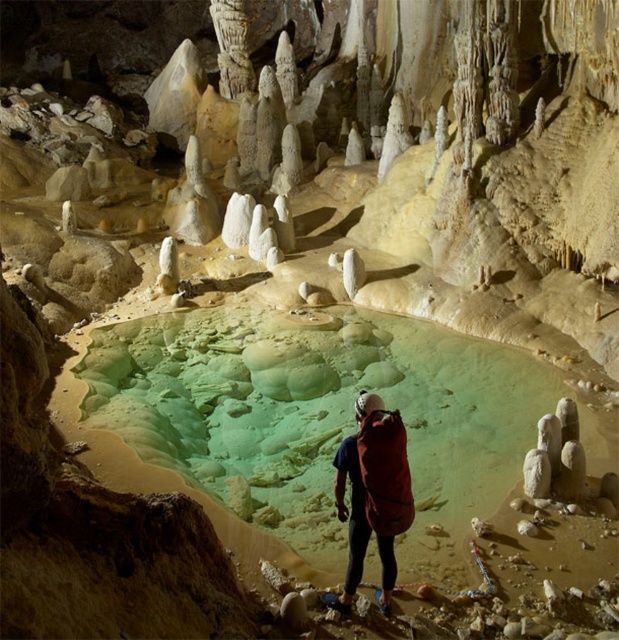
Which is more to the right, green translucent water at center or matte orange backpack at center?

green translucent water at center is more to the right.

Does point (189, 435) come closer to viewer compared to point (383, 456)?

No.

This screenshot has width=619, height=640. What do you see at coordinates (321, 420) in the screenshot?
I see `green translucent water at center` at bounding box center [321, 420].

The height and width of the screenshot is (640, 619). Find the location of `green translucent water at center`. green translucent water at center is located at coordinates (321, 420).